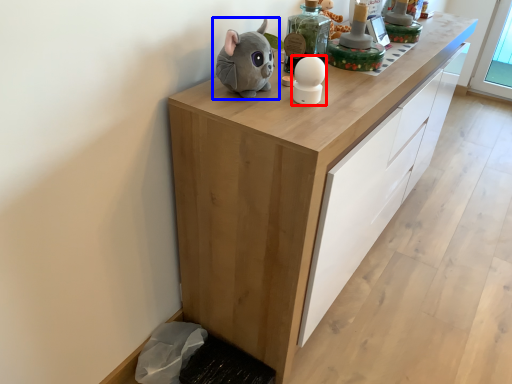
Question: Which object is closer to the camera taking this photo, toy (highlighted by a red box) or toy (highlighted by a blue box)?

Choices:
 (A) toy
 (B) toy

Answer: (B)